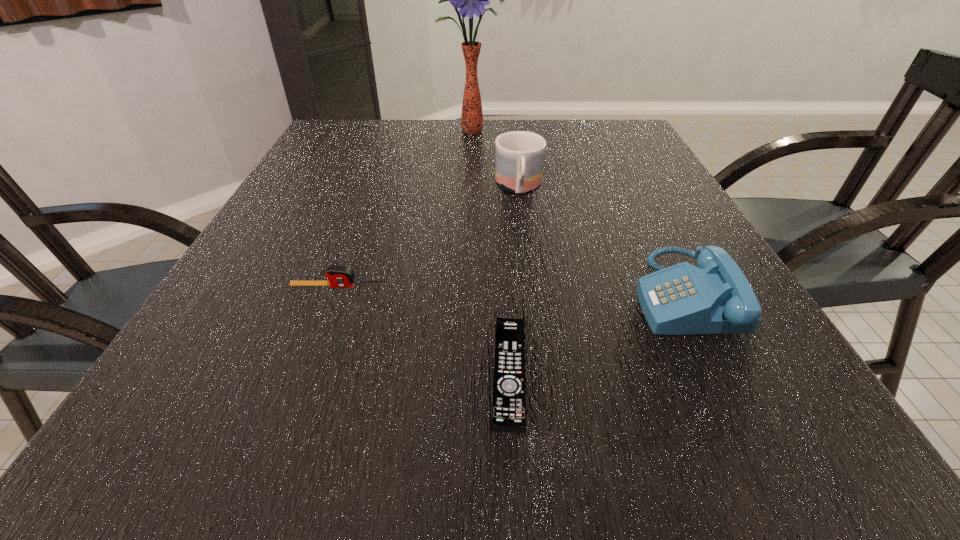
What are the coordinates of `blank area located on the dial of the rightmost object` in the screenshot? It's located at (411, 294).

Where is `free space located 0.300m on the dial of the rightmost object`? This screenshot has height=540, width=960. free space located 0.300m on the dial of the rightmost object is located at coordinates [463, 294].

Where is `free space located on the dial of the rightmost object`? This screenshot has width=960, height=540. free space located on the dial of the rightmost object is located at coordinates (411, 294).

Where is `vacant space located on the back of the tape measure`? The image size is (960, 540). vacant space located on the back of the tape measure is located at coordinates (356, 239).

Find the location of `blank area located 0.370m on the back of the remote control`. blank area located 0.370m on the back of the remote control is located at coordinates (499, 203).

Identify the location of object that is at the far edge. (471, 0).

The height and width of the screenshot is (540, 960). Identify the location of object at the near edge. (509, 391).

What are the coordinates of `object present at the left edge` in the screenshot? It's located at (339, 276).

The width and height of the screenshot is (960, 540). Identify the location of object that is at the right edge. (715, 297).

Identify the location of vacant space at the far edge of the desktop. (448, 130).